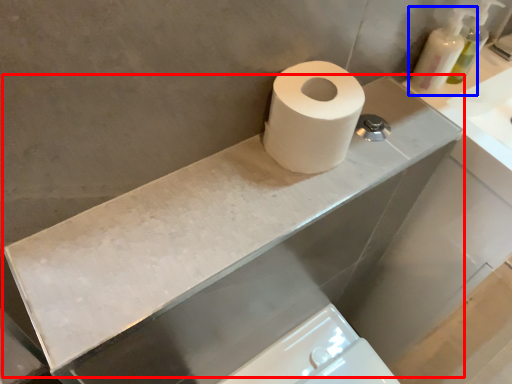
Question: Which object appears farthest to the camera in this image, counter top (highlighted by a red box) or soap dispenser (highlighted by a blue box)?

Choices:
 (A) counter top
 (B) soap dispenser

Answer: (B)